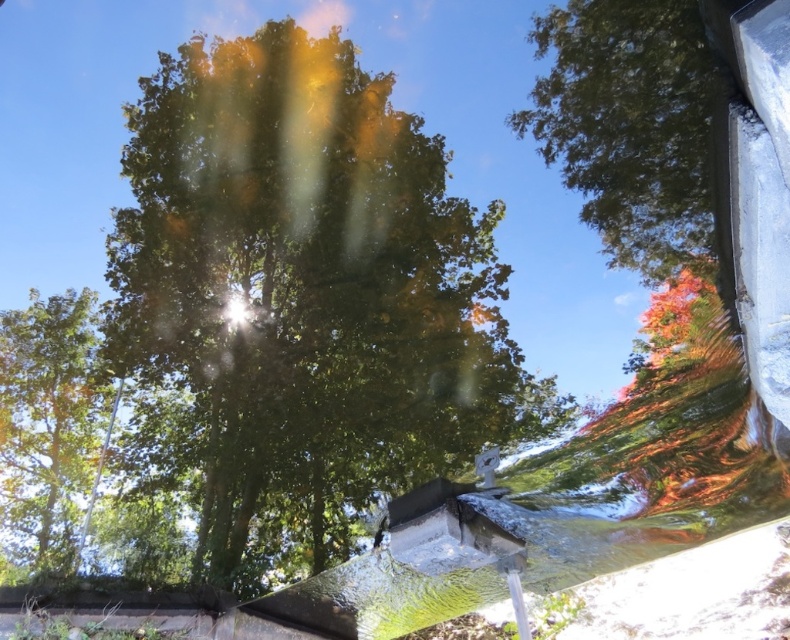
Question: Can you confirm if green leafy tree at center is positioned to the left of green leafy tree at left?

Choices:
 (A) no
 (B) yes

Answer: (A)

Question: Which point is closer to the camera?

Choices:
 (A) green leafy tree at center
 (B) green leafy tree at upper right

Answer: (B)

Question: Can you confirm if green leafy tree at center is positioned below green leafy tree at upper right?

Choices:
 (A) yes
 (B) no

Answer: (A)

Question: Which point appears farthest from the camera in this image?

Choices:
 (A) (627, 148)
 (B) (514, 392)
 (C) (83, 422)

Answer: (C)

Question: In this image, where is green leafy tree at center located relative to green leafy tree at upper right?

Choices:
 (A) left
 (B) right

Answer: (A)

Question: Which object appears closest to the camera in this image?

Choices:
 (A) green leafy tree at left
 (B) green leafy tree at center

Answer: (B)